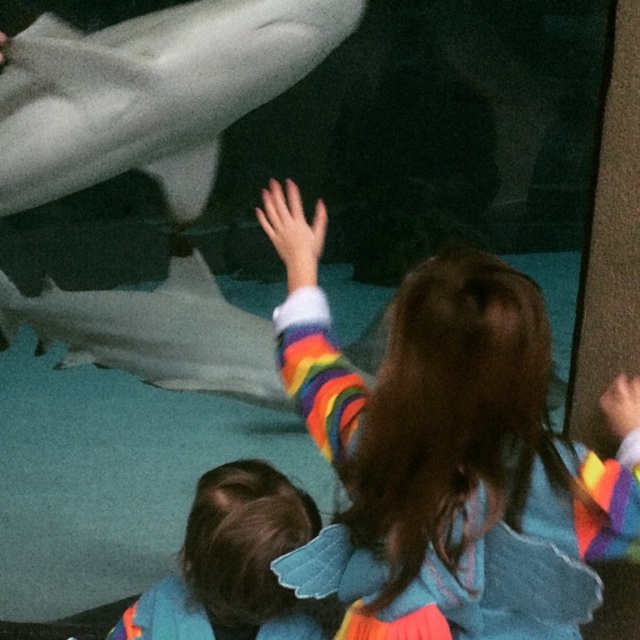
From the picture: You are standing at the entrance of the aquarium exhibit and want to take a photo of the point at coordinate point [209,288]. The camera you have can focus on objects up to 4 meters away. Will the point be in focus?

The distance of point [209,288] from viewer is 3.71 meters, so yes, the point will be in focus because it is within the camera focus range of 4 meters.

You are a visitor at the aquarium and want to take a photo of the large white shark in the tank. There is a rainbow fabric dress at center in your way. Where should you move to get an unobstructed view of the shark?

The rainbow fabric dress at center is located at point (x=449, y=456), so you should move to a position that avoids this point to get an unobstructed view of the shark.

You are a parent at the aquarium with your child. You notice the white smooth shark at lower left and the rainbow striped sweater at lower left. Which object is larger in size?

The white smooth shark at lower left is bigger than the rainbow striped sweater at lower left.